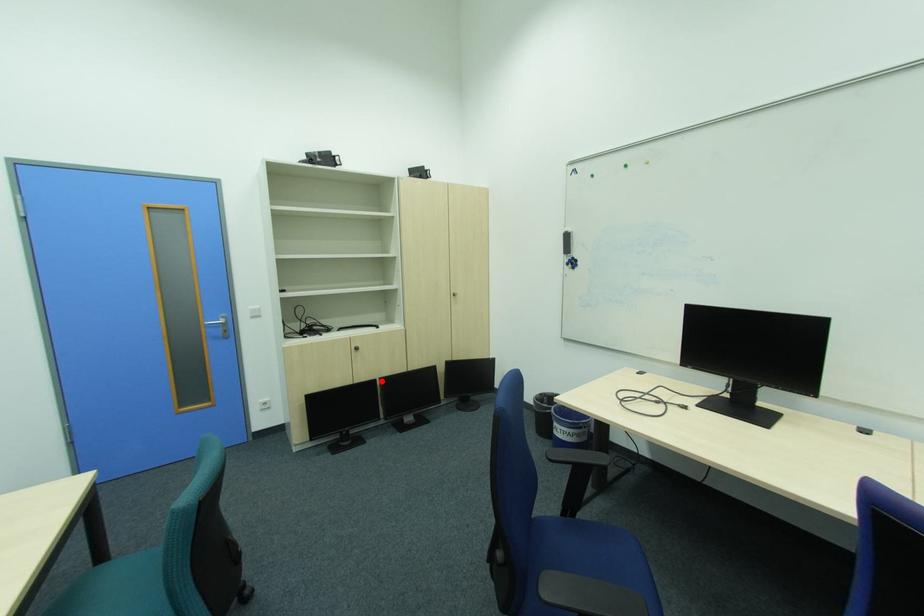
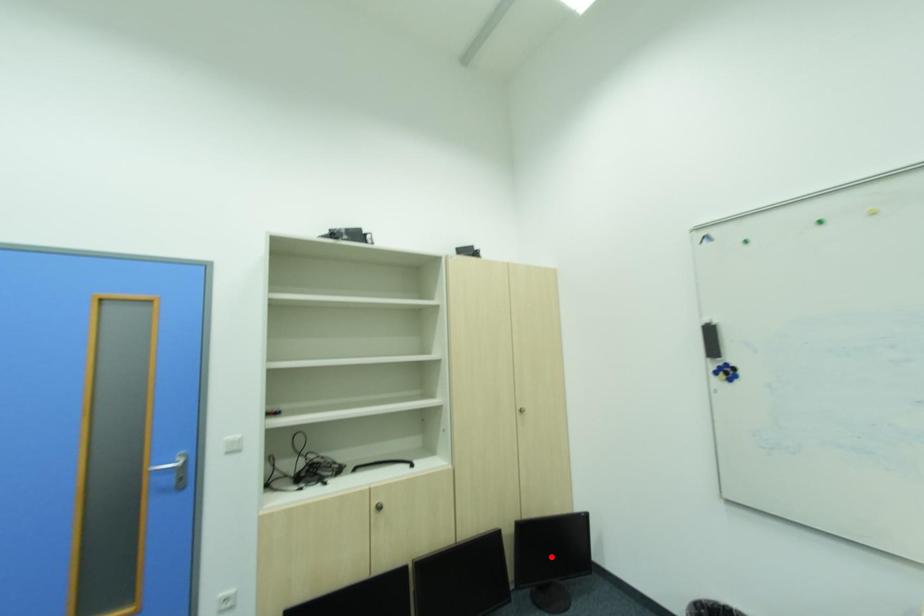
I am providing you with two images of the same scene from different viewpoints. A red point is marked on the first image and another point is marked on the second image. Are the points marked in image1 and image2 representing the same 3D position?

No